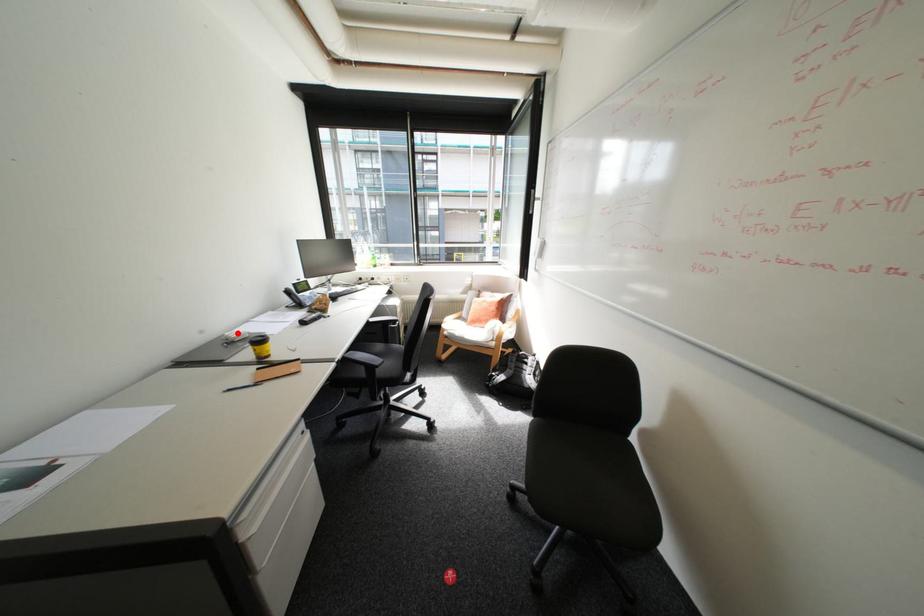
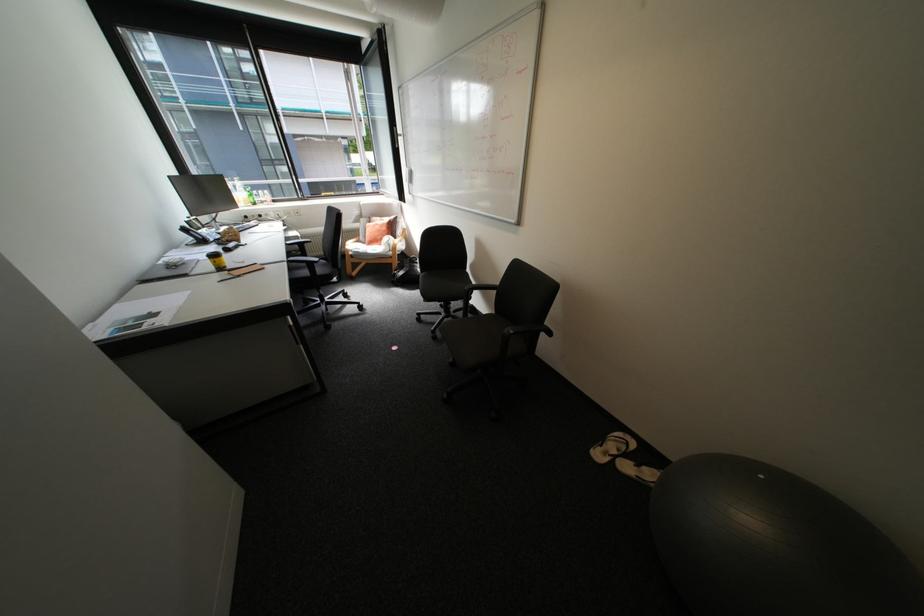
The point at the highlighted location is marked in the first image. Where is the corresponding point in the second image?

(176, 260)